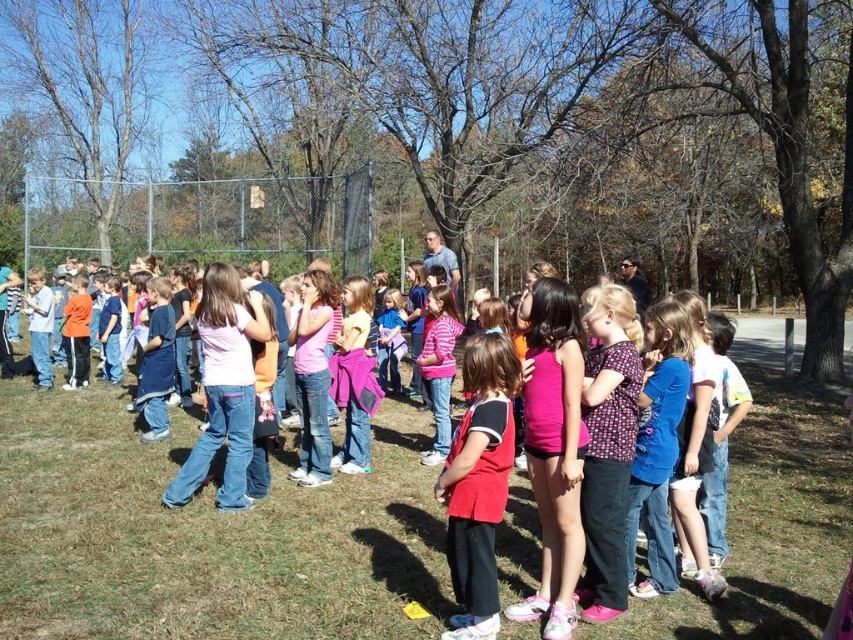
You are a photographer trying to capture a group photo of the children. You notice the red matte shirt at center and the blue denim jeans at center. Which clothing item should you adjust to ensure both are fully visible in the frame?

The red matte shirt at center has a lesser height compared to blue denim jeans at center. To ensure both are fully visible, you should adjust the blue denim jeans at center to lower its height so it doesn not block the view of the red matte shirt at center.

From the picture: You are a photographer trying to capture a group photo of the children. You notice the red matte shirt at center and the blue denim jeans at center. Which clothing item should you focus on to ensure it fits entirely within the frame if your camera has a limited horizontal field of view?

The red matte shirt at center has a smaller width than the blue denim jeans at center, so focusing on the red matte shirt at center would ensure it fits entirely within the frame given the camera has a limited horizontal field of view.